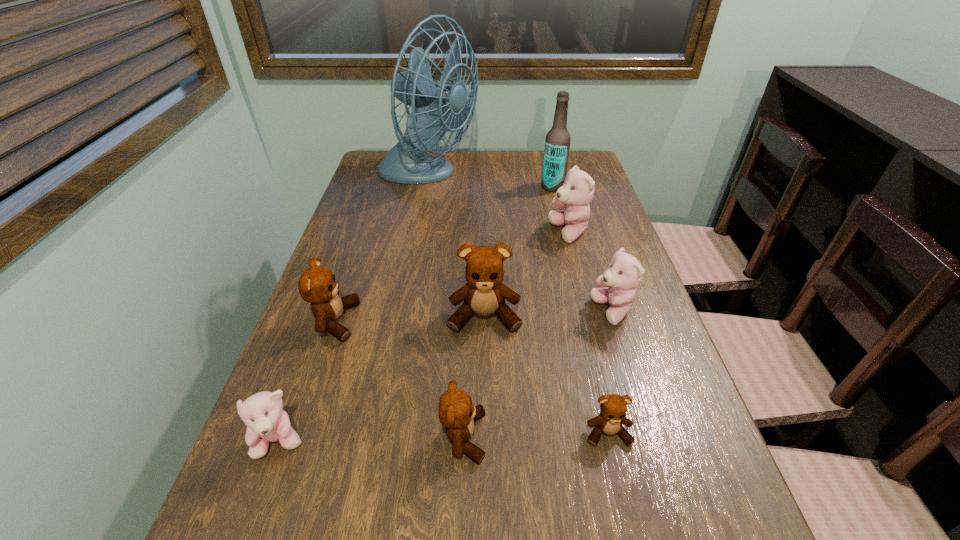
Find the location of a particular element. This screenshot has width=960, height=540. free space located 0.240m at the face of the second biggest pink teddy bear is located at coordinates (482, 312).

Find the location of a particular element. free region located 0.080m at the face of the second biggest pink teddy bear is located at coordinates (555, 312).

Locate an element on the screen. Image resolution: width=960 pixels, height=540 pixels. free space located 0.110m at the face of the second biggest pink teddy bear is located at coordinates (541, 312).

Where is `vacant space located on the front-facing side of the leftmost brown teddy bear`? vacant space located on the front-facing side of the leftmost brown teddy bear is located at coordinates (441, 321).

At what (x,y) coordinates should I click in order to perform the action: click on free location located 0.280m on the front-facing side of the second smallest brown teddy bear. Please return your answer as a coordinate pair (x, y). The height and width of the screenshot is (540, 960). Looking at the image, I should click on (652, 437).

The image size is (960, 540). Identify the location of free space located at the face of the smallest pink teddy bear. (256, 509).

Locate an element on the screen. fan situated at the far edge is located at coordinates (435, 107).

In order to click on beer bottle positioned at the far edge in this screenshot , I will do `click(557, 143)`.

Locate an element on the screen. fan that is at the left edge is located at coordinates (435, 107).

Image resolution: width=960 pixels, height=540 pixels. I want to click on beer bottle located at the right edge, so click(557, 143).